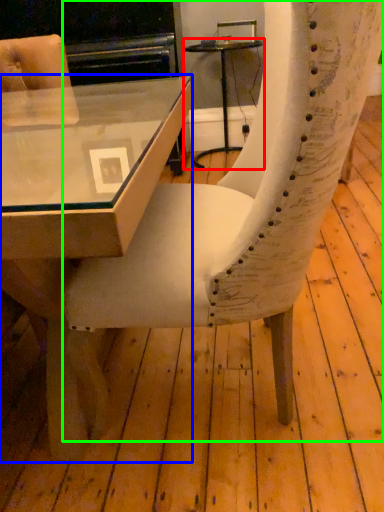
Question: Which object is the farthest from table (highlighted by a red box)? Choose among these: table (highlighted by a blue box) or chair (highlighted by a green box).

Choices:
 (A) table
 (B) chair

Answer: (B)